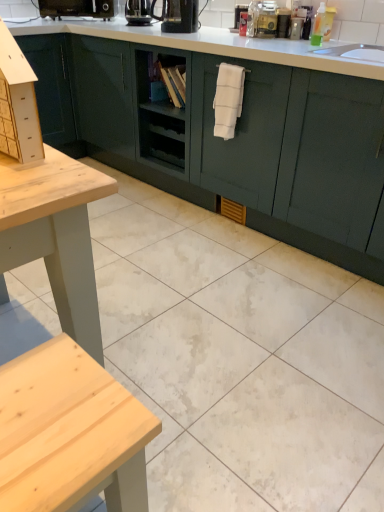
Question: Is translucent plastic bottle at upper center in front of or behind translucent plastic bottle at upper right in the image?

Choices:
 (A) behind
 (B) front

Answer: (A)

Question: Is point (264, 10) closer or farther from the camera than point (314, 15)?

Choices:
 (A) closer
 (B) farther

Answer: (B)

Question: Which of these objects is positioned closest to the translucent plastic bottle at upper center?

Choices:
 (A) white glossy tile at center
 (B) black plastic coffee machine at upper left, arranged as the third coffee machine when viewed from the right
 (C) black glossy coffee machine at upper center, which is the 2th coffee machine in back-to-front order
 (D) black plastic coffee machine at upper center, arranged as the third coffee machine when viewed from the left
 (E) translucent plastic bottle at upper right

Answer: (E)

Question: Which is nearer to the black plastic coffee machine at upper center, arranged as the third coffee machine when viewed from the left?

Choices:
 (A) white glossy tile at center
 (B) black glossy coffee machine at upper center, which is the 2th coffee machine in back-to-front order
 (C) translucent plastic bottle at upper center
 (D) black plastic coffee machine at upper left, the third coffee machine when ordered from front to back
 (E) translucent plastic bottle at upper right

Answer: (B)